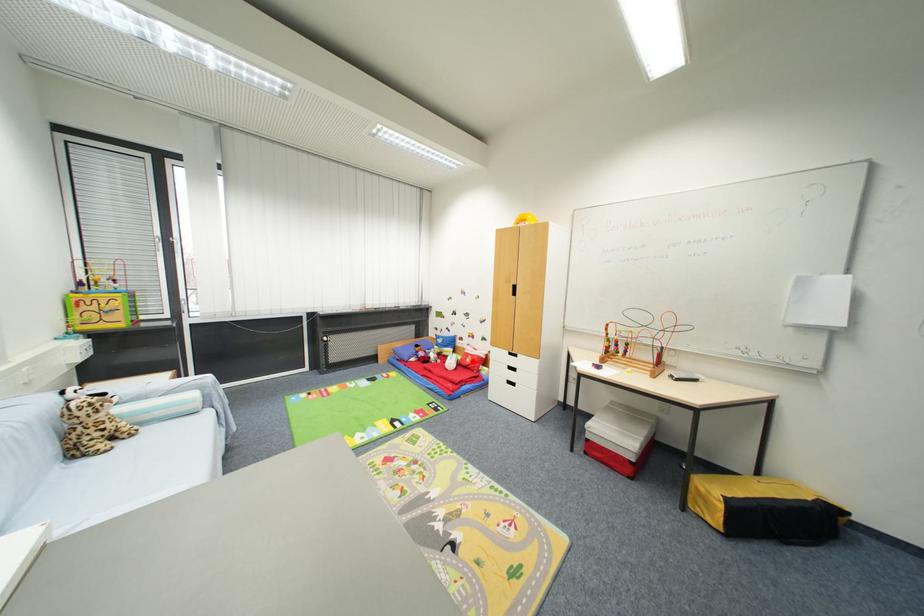
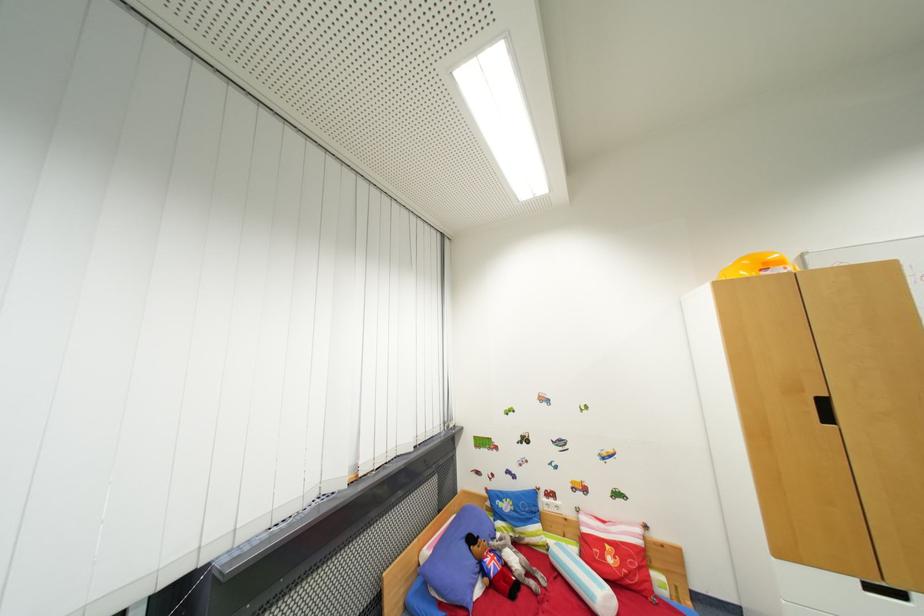
Question: I am providing you with two images of the same scene from different viewpoints. Image1 has a red point marked. In image2, the corresponding 3D location appears at what relative position? Reply with the corresponding letter.

Choices:
 (A) Closer
 (B) Farther

Answer: (A)